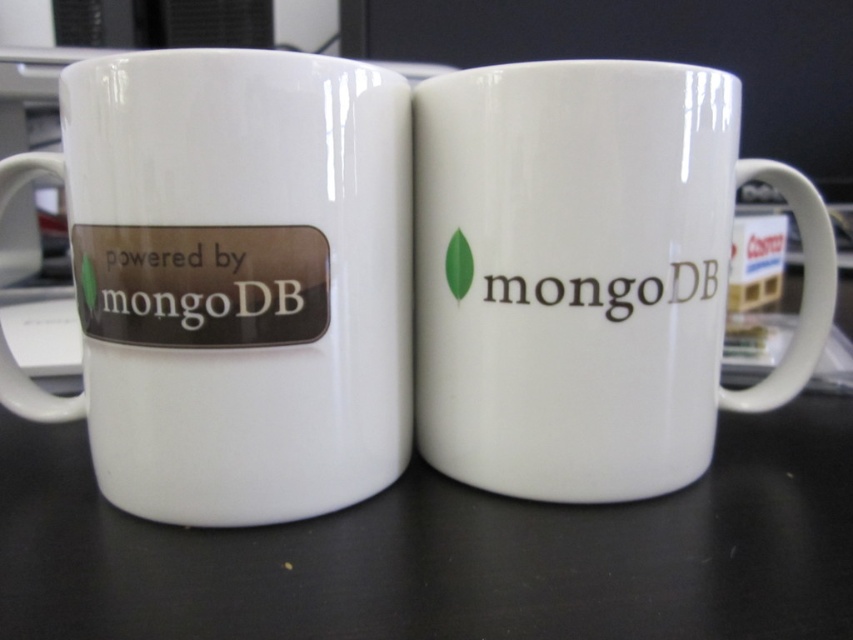
You are a barista trying to place a new coffee cup at point (x=587, y=275). Is there enough space to place the cup there?

The point (x=587, y=275) indicates the location of the white ceramic mug at center, so placing another cup there would not be possible as the space is already occupied.

You are a barista who needs to place a 7 inch wide coffee tray between the two mugs. Based on the scene, can the tray fit between the white glossy mug at left and the white glossy mug at center without touching either?

The white glossy mug at left and white glossy mug at center are 6.71 inches apart. Since the tray is 7 inches wide, it cannot fit between them as the distance is less than the tray width.